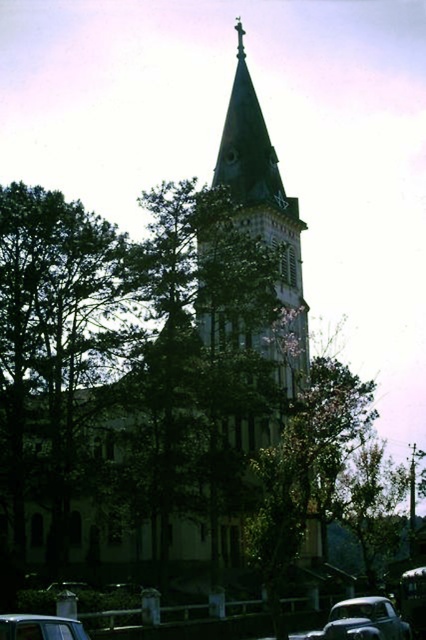
You are a pedestrian standing at the base of the church bell tower. You want to walk to the shiny silver car at lower center. Which direction should you go relative to the metallic silver car at lower left?

The shiny silver car at lower center is 28.51 meters away from the metallic silver car at lower left. To reach the shiny silver car at lower center, you should walk away from the metallic silver car at lower left in the direction indicated by the distance between them.

You are a photographer trying to capture the church bell tower in the background. You have a camera with a standard lens that can focus on objects up to 50 meters away. The green leafy tree at center is blocking your view. Can you determine if the shiny silver car at lower center is closer to you than the tree?

The green leafy tree at center is larger in size than the shiny silver car at lower center. Since the tree is blocking the view of the bell tower, it is likely closer to you than the car. Therefore, the car is farther away than the tree and cannot be used to obstruct the tree.

You are standing in front of the church and notice a point marked at coordinates (134, 371). Based on the scene description, what object does this point most likely represent?

The point at (134, 371) corresponds to the green leafy tree at center, as stated in the Objects Description.